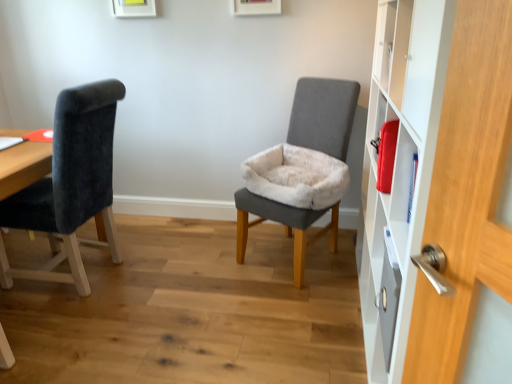
This screenshot has width=512, height=384. I want to click on free space in front of gray fabric chair at center, which is the 2th chair from left to right, so click(293, 310).